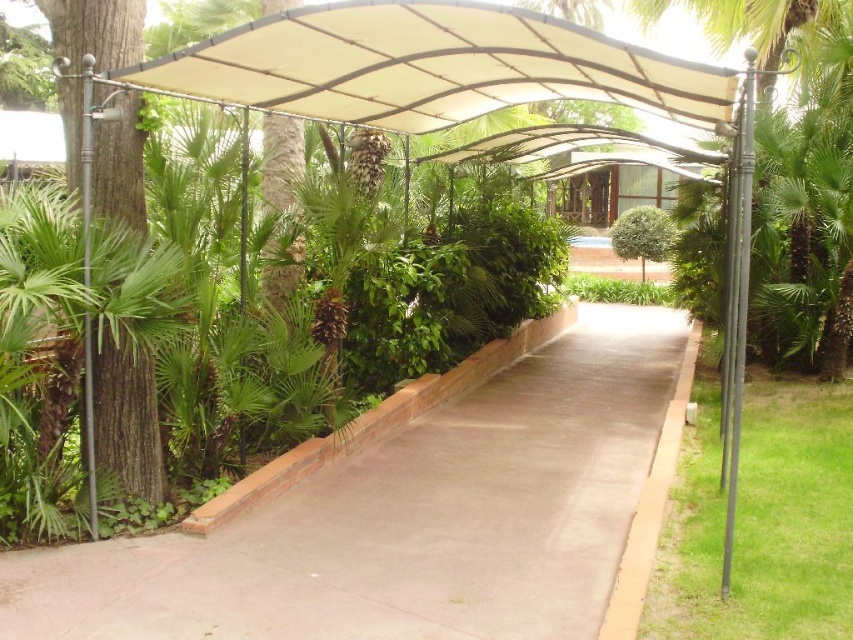
Does concrete at center appear under brown rough tree at left?

Indeed, concrete at center is positioned under brown rough tree at left.

Between point (207, 592) and point (51, 17), which one is positioned in front?

Point (207, 592) is in front.

Locate an element on the screen. concrete at center is located at coordinates (410, 513).